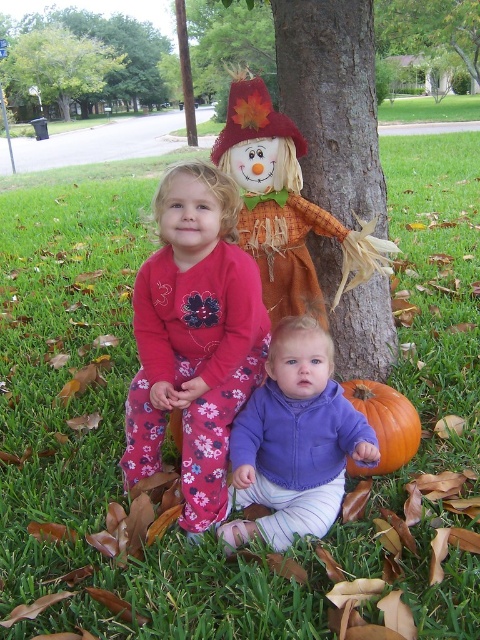
Question: Is green leafy tree at upper center positioned behind orange matte pumpkin at lower center?

Choices:
 (A) no
 (B) yes

Answer: (B)

Question: Which of these objects is positioned closest to the orange matte pumpkin at lower center?

Choices:
 (A) green leafy tree at upper left
 (B) matte orange scarecrow at center
 (C) purple fleece jacket at lower center

Answer: (C)

Question: Based on their relative distances, which object is nearer to the orange matte pumpkin at lower center?

Choices:
 (A) green leafy tree at upper left
 (B) pink fleece pajamas at center

Answer: (B)

Question: Is green leafy tree at upper left further to the viewer compared to green leafy tree at upper center?

Choices:
 (A) yes
 (B) no

Answer: (A)

Question: Among these objects, which one is farthest from the camera?

Choices:
 (A) matte orange scarecrow at center
 (B) orange matte pumpkin at lower center

Answer: (B)

Question: Is green leafy tree at upper left to the left of green leafy tree at upper center from the viewer's perspective?

Choices:
 (A) no
 (B) yes

Answer: (B)